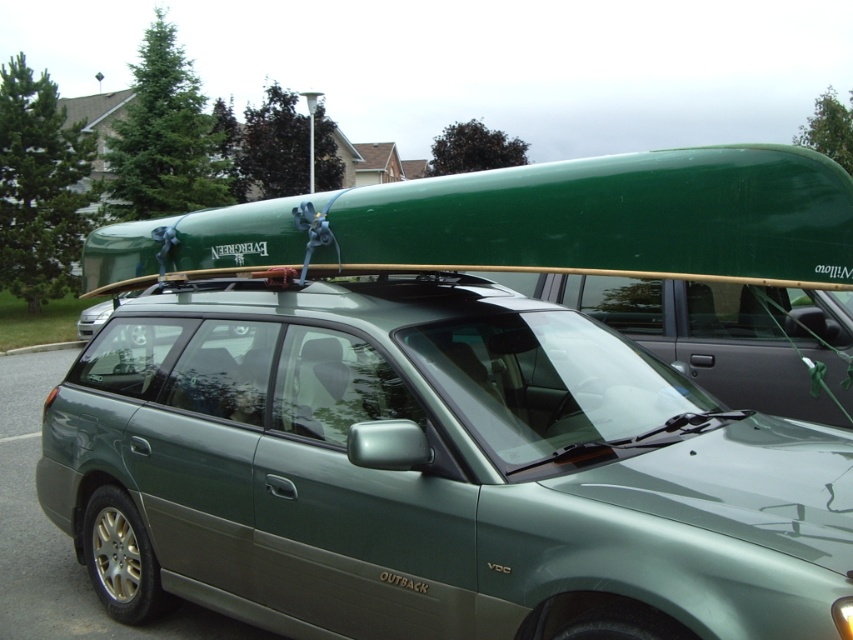
You are standing at point [379,195] and want to walk to point [225,564]. Which direction should you move in relation to the Subaru Outback parked in the image?

You should move behind the Subaru Outback because point [225,564] is located behind point [379,195] in the image.

You are planning to load a new surfboard onto your green matte car at center. The surfboard you have is the same size as the green matte surfboard at upper center. Will the surfboard fit on top of the car without exceeding its height limit?

The green matte car at center is taller than the green matte surfboard at upper center. Since the surfboard is the same size as the one shown, it will fit on top of the car without exceeding the height limit because the car is taller.

Consider the image. You are planning to transport a green matte surfboard at upper center to the beach. You have a green matte car at center available. Based on their sizes, will the surfboard fit inside the car?

The green matte car at center is bigger than the green matte surfboard at upper center, so the surfboard should fit inside the car.